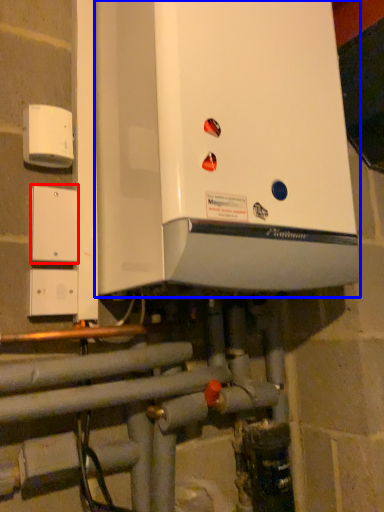
Question: Which point is closer to the camera, light switch (highlighted by a red box) or home appliance (highlighted by a blue box)?

Choices:
 (A) light switch
 (B) home appliance

Answer: (B)